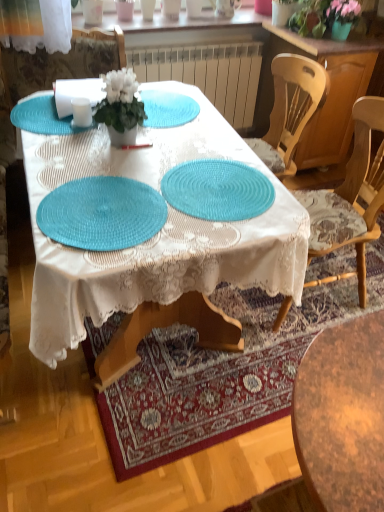
Question: From a real-world perspective, relative to teal woven placemat at center, positioned as the 3th glass plate in top-to-bottom order, is green leafy plant at upper right vertically above or below?

Choices:
 (A) below
 (B) above

Answer: (B)

Question: Would you say green leafy plant at upper right is inside or outside teal woven placemat at center, the 1th glass plate ordered from the bottom?

Choices:
 (A) inside
 (B) outside

Answer: (B)

Question: Considering the real-world distances, which object is closest to the white matte pot at center?

Choices:
 (A) green leafy plant at upper right
 (B) teal woven placemat at center, which ranks as the second glass plate in top-to-bottom order
 (C) teal woven placemat at upper left, acting as the first glass plate starting from the top
 (D) wooden cabinet at right
 (E) matte white chair at upper left, the second chair in the right-to-left sequence

Answer: (C)

Question: Based on their relative distances, which object is nearer to the wooden chair at right, which is the first chair from right to left?

Choices:
 (A) teal woven placemat at center
 (B) white glossy cup at upper center
 (C) wooden cabinet at right
 (D) teal woven placemat at upper left, acting as the first glass plate starting from the top
 (E) matte white chair at upper left, the second chair in the right-to-left sequence

Answer: (A)